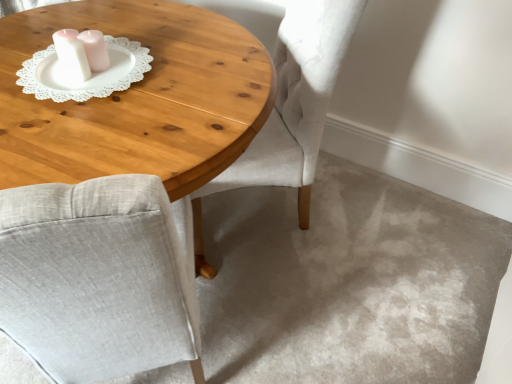
What do you see at coordinates (91, 74) in the screenshot?
I see `white lace doily at upper left` at bounding box center [91, 74].

What do you see at coordinates (137, 98) in the screenshot? I see `wooden coffee table at center` at bounding box center [137, 98].

You are a GUI agent. You are given a task and a screenshot of the screen. Output one action in this format:
    pyautogui.click(x=<x>, y=<y>)
    Task: Click on the light gray fabric chair at center
    The height and width of the screenshot is (384, 512).
    Given the screenshot: What is the action you would take?
    pyautogui.click(x=291, y=109)

Can you confirm if light gray fabric chair at center is bigger than white lace doily at upper left?

Correct, light gray fabric chair at center is larger in size than white lace doily at upper left.

Is light gray fabric chair at center facing away from white lace doily at upper left?

That's not correct — light gray fabric chair at center is not looking away from white lace doily at upper left.

Is light gray fabric chair at center at the right side of white lace doily at upper left?

Indeed, light gray fabric chair at center is positioned on the right side of white lace doily at upper left.

What's the angular difference between light gray fabric chair at center and white lace doily at upper left's facing directions?

The angle between the facing direction of light gray fabric chair at center and the facing direction of white lace doily at upper left is 28.8 degrees.

Is white lace doily at upper left facing towards light gray fabric chair at center?

No, white lace doily at upper left does not turn towards light gray fabric chair at center.

Considering the sizes of white lace doily at upper left and light gray fabric chair at center in the image, is white lace doily at upper left taller or shorter than light gray fabric chair at center?

Clearly, white lace doily at upper left is shorter compared to light gray fabric chair at center.

Based on the photo, considering the relative sizes of white lace doily at upper left and light gray fabric chair at center in the image provided, is white lace doily at upper left bigger than light gray fabric chair at center?

No, white lace doily at upper left is not bigger than light gray fabric chair at center.

Does point (58, 80) lie in front of point (260, 113)?

No, it is behind (260, 113).

Is white lace doily at upper left not close to wooden coffee table at center?

No, there isn't a large distance between white lace doily at upper left and wooden coffee table at center.

Where is `saucer that appears above the wooden coffee table at center (from the image's perspective)`? saucer that appears above the wooden coffee table at center (from the image's perspective) is located at coordinates (91, 74).

Is wooden coffee table at center not close to white lace doily at upper left?

They are positioned close to each other.

What's the angular difference between wooden coffee table at center and white lace doily at upper left's facing directions?

wooden coffee table at center and white lace doily at upper left are facing 84.2 degrees away from each other.

Is wooden coffee table at center far from light gray fabric chair at center?

Actually, wooden coffee table at center and light gray fabric chair at center are a little close together.

How distant is wooden coffee table at center from light gray fabric chair at center?

14.29 inches.

Which is behind, wooden coffee table at center or light gray fabric chair at center?

light gray fabric chair at center.

In terms of size, does wooden coffee table at center appear bigger or smaller than light gray fabric chair at center?

wooden coffee table at center is bigger than light gray fabric chair at center.

Is light gray fabric chair at center not close to wooden coffee table at center?

No, light gray fabric chair at center is not far from wooden coffee table at center.

From the image's perspective, is light gray fabric chair at center above or below wooden coffee table at center?

light gray fabric chair at center is above wooden coffee table at center.

Which object is positioned more to the left, light gray fabric chair at center or wooden coffee table at center?

Positioned to the left is wooden coffee table at center.

I want to click on chair that is below the white lace doily at upper left (from the image's perspective), so click(x=291, y=109).

I want to click on chair on the right of the white lace doily at upper left, so click(291, 109).

Based on their spatial positions, is wooden coffee table at center or white lace doily at upper left further from light gray fabric chair at center?

Among the two, white lace doily at upper left is located further to light gray fabric chair at center.

From the image, which object appears to be nearer to white lace doily at upper left, light gray fabric chair at center or wooden coffee table at center?

Among the two, wooden coffee table at center is located nearer to white lace doily at upper left.

Estimate the real-world distances between objects in this image. Which object is closer to wooden coffee table at center, white lace doily at upper left or light gray fabric chair at center?

white lace doily at upper left is positioned closer to the anchor wooden coffee table at center.

Which object lies nearer to the anchor point white lace doily at upper left, wooden coffee table at center or light gray fabric chair at center?

wooden coffee table at center.

Looking at this image, based on their spatial positions, is light gray fabric chair at center or white lace doily at upper left closer to wooden coffee table at center?

The object closer to wooden coffee table at center is white lace doily at upper left.

Which object lies further to the anchor point light gray fabric chair at center, white lace doily at upper left or wooden coffee table at center?

white lace doily at upper left is positioned further to the anchor light gray fabric chair at center.

Locate an element on the screen. The width and height of the screenshot is (512, 384). saucer between wooden coffee table at center and light gray fabric chair at center in the horizontal direction is located at coordinates (91, 74).